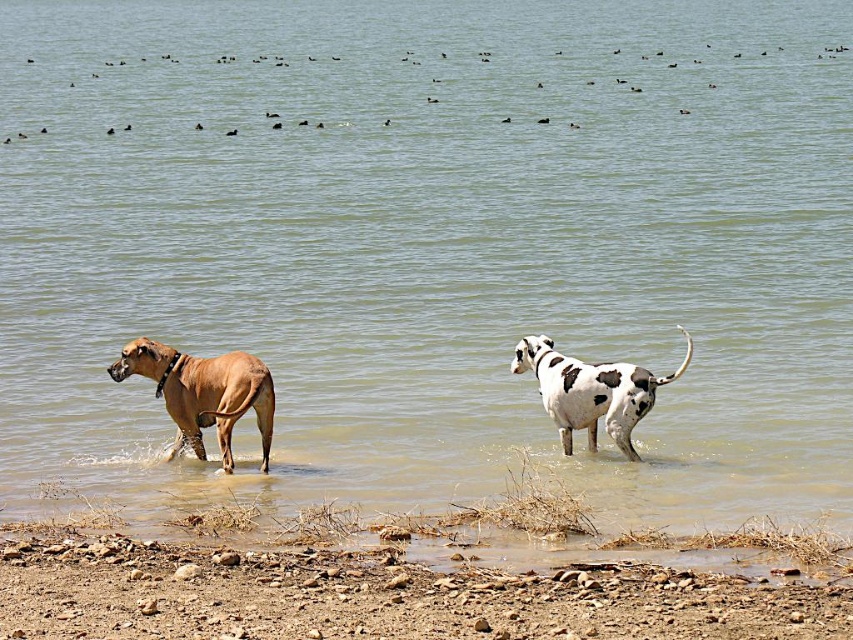
Question: Is dried mud at lower center wider than white spotted fur dog at center?

Choices:
 (A) no
 (B) yes

Answer: (B)

Question: Where is brown smooth coat dog at left located in relation to white spotted fur dog at center in the image?

Choices:
 (A) above
 (B) below

Answer: (B)

Question: Which of these objects is positioned closest to the brown smooth coat dog at left?

Choices:
 (A) white spotted fur dog at center
 (B) dried mud at lower center

Answer: (A)

Question: Can you confirm if dried mud at lower center is bigger than brown smooth coat dog at left?

Choices:
 (A) yes
 (B) no

Answer: (A)

Question: Which is nearer to the dried mud at lower center?

Choices:
 (A) brown smooth coat dog at left
 (B) white spotted fur dog at center

Answer: (A)

Question: Which of the following is the farthest from the observer?

Choices:
 (A) (202, 378)
 (B) (550, 400)

Answer: (B)